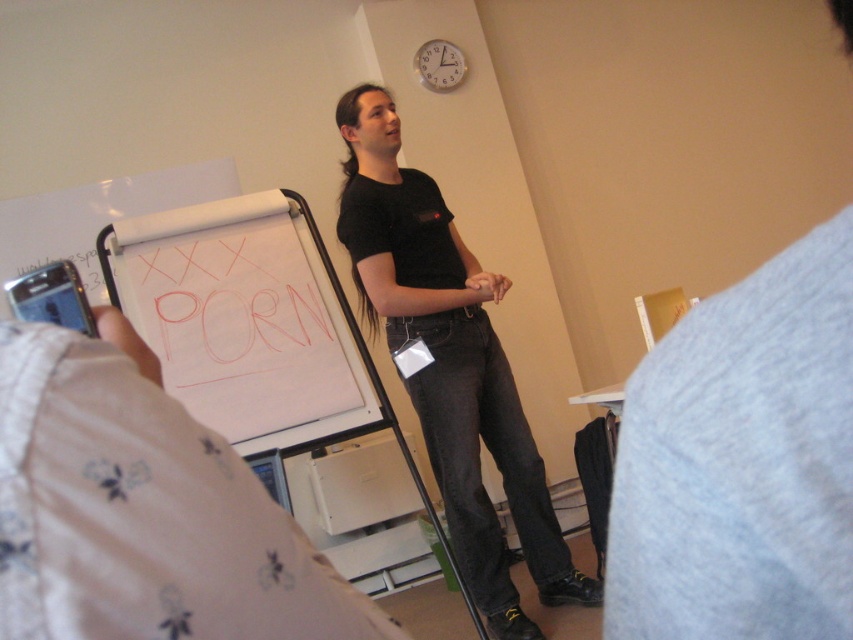
You are a photographer in the room and want to take a photo of the white paperboard at center without the black matte shirt at center blocking it. Is it possible to do so without moving either object?

The black matte shirt at center is much taller than the white paperboard at center, so it would block the view. Therefore, it is not possible to take a photo of the white paperboard at center without moving either object.

You are a photographer in the room and want to take a photo of the scene. The black matte shirt at center and white paperboard at center are both in your viewfinder. Which object will appear narrower in the photo?

The black matte shirt at center will appear narrower in the photo since it is thinner than the white paperboard at center.

You are a photographer in the room and want to take a photo of the black matte shirt at center and the white paperboard at center. Which object should you focus on first if you want to capture both clearly in the same frame?

The black matte shirt at center is bigger than the white paperboard at center, so you should focus on the black matte shirt at center first to ensure both are in focus.